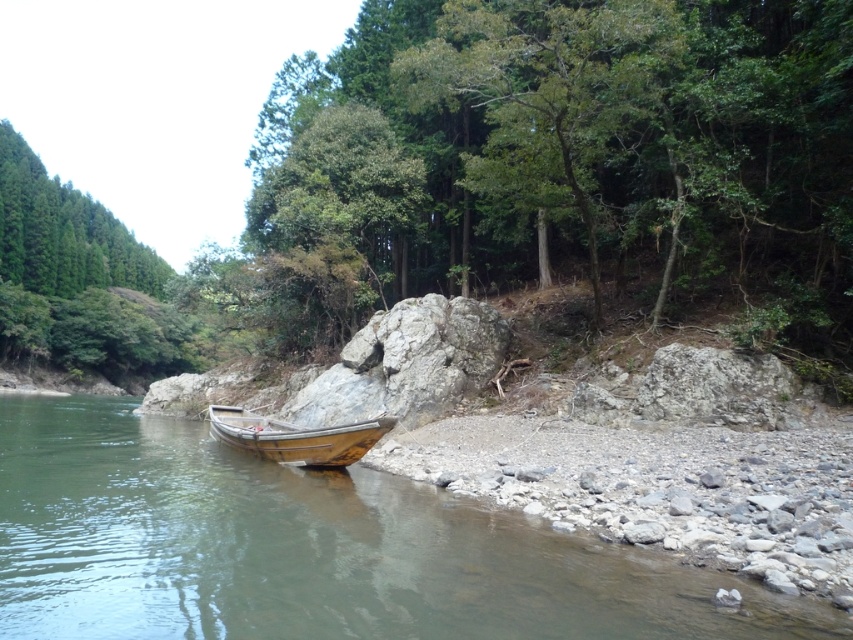
You are standing on the riverbank and want to take a photo of both the green leafy tree at center and the wooden boat at lower left. Which object should you position closer to the left side of your camera frame to include both in the photo?

The wooden boat at lower left should be positioned closer to the left side of your camera frame because the green leafy tree at center is on the right side of it.

You are a photographer planning to take a picture of the wooden boat at lower left and the wooden boat at center. Which boat should you focus on to capture the most detailed image, considering their sizes in the frame?

The wooden boat at lower left is much taller than the wooden boat at center, so focusing on the wooden boat at lower left will allow you to capture more detailed features in your photo.

You are standing at the point with coordinates [309,548] in the riverside scene. Based on the description, what object are you most likely standing on?

The point at [309,548] indicates the wooden boat at lower left, so you are most likely standing on the wooden boat at lower left.